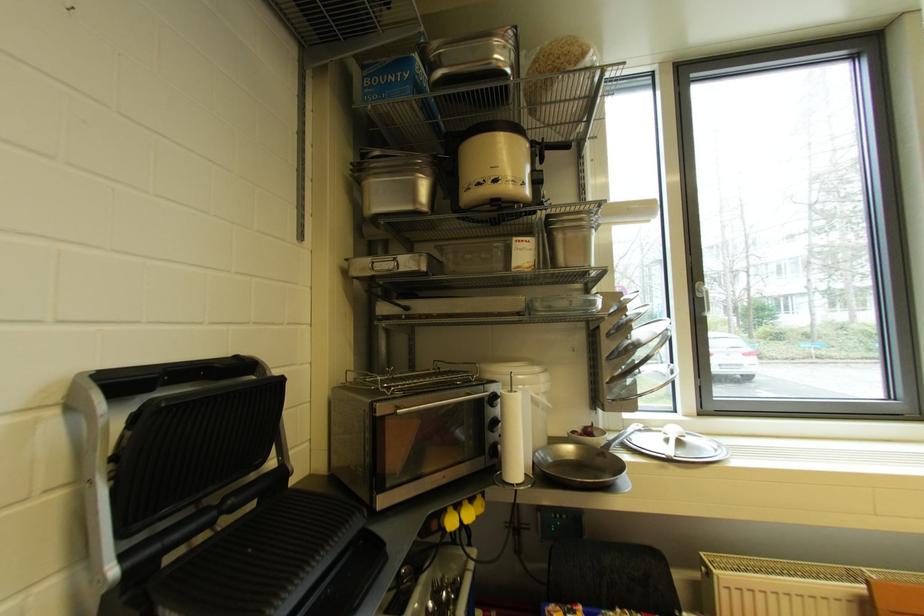
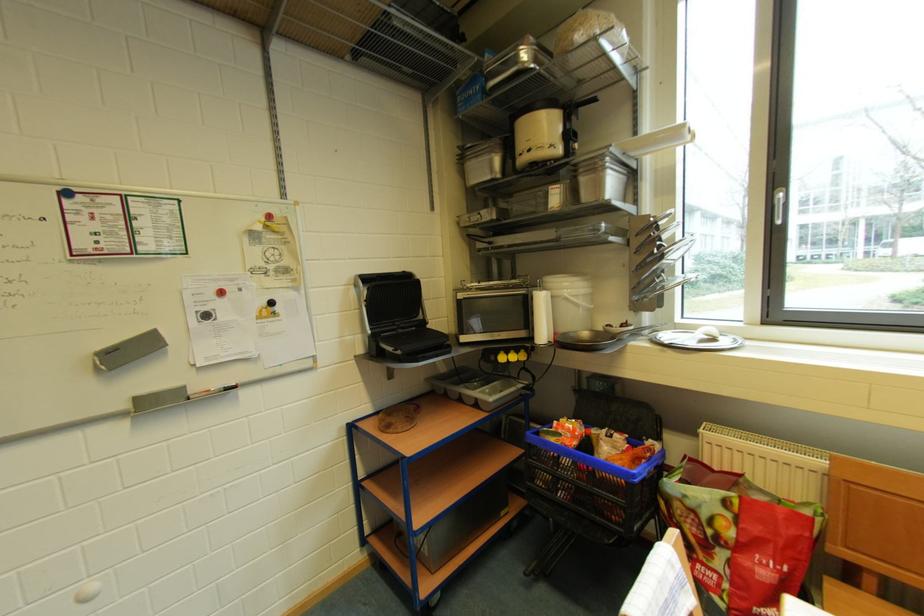
Find the pixel in the second image that matches pixel 442 528 in the first image.

(500, 361)